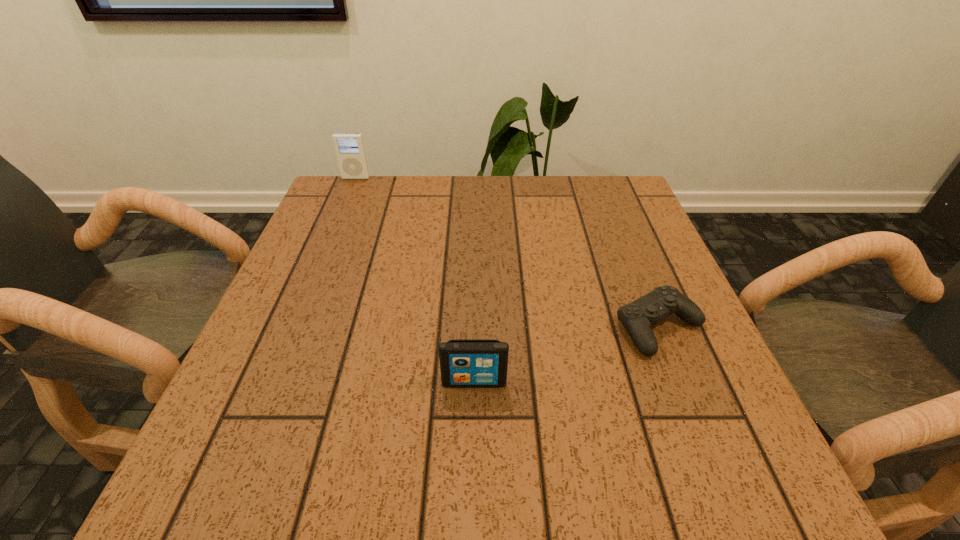
The height and width of the screenshot is (540, 960). I want to click on object that is at the left edge, so click(349, 147).

I want to click on object that is at the right edge, so coord(637,317).

Locate an element on the screen. The image size is (960, 540). object present at the far left corner is located at coordinates (349, 147).

What are the coordinates of `blank space at the far edge` in the screenshot? It's located at (414, 191).

In the image, there is a desktop. At what (x,y) coordinates should I click in order to perform the action: click on vacant area at the near edge. Please return your answer as a coordinate pair (x, y). This screenshot has width=960, height=540. Looking at the image, I should click on (401, 464).

I want to click on free space at the left edge of the desktop, so click(274, 330).

Image resolution: width=960 pixels, height=540 pixels. What are the coordinates of `vacant region at the right edge of the desktop` in the screenshot? It's located at (693, 383).

You are a GUI agent. You are given a task and a screenshot of the screen. Output one action in this format:
    pyautogui.click(x=<x>, y=<y>)
    Task: Click on the vacant space at the far left corner of the desktop
    The image size is (960, 540).
    Given the screenshot: What is the action you would take?
    pyautogui.click(x=368, y=206)

Find the location of a particular element. vacant space at the near left corner of the desktop is located at coordinates (218, 479).

In the image, there is a desktop. At what (x,y) coordinates should I click in order to perform the action: click on vacant space at the far right corner. Please return your answer as a coordinate pair (x, y). This screenshot has height=540, width=960. Looking at the image, I should click on (627, 183).